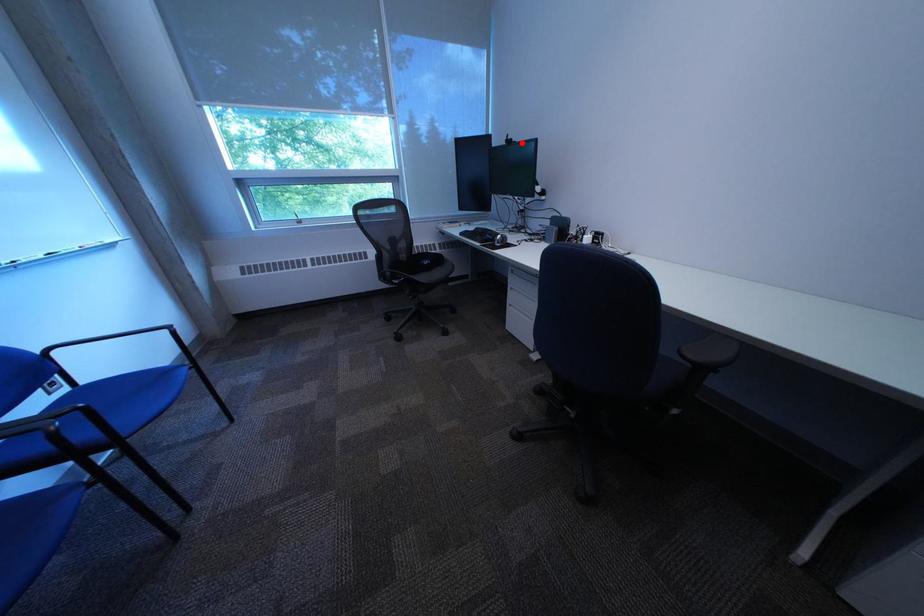
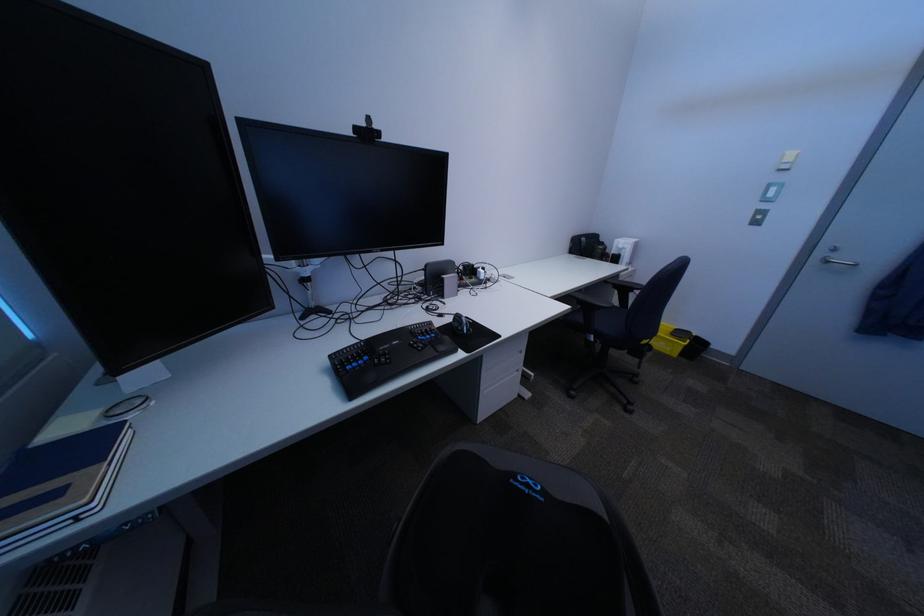
Question: I am providing you with two images of the same scene from different viewpoints. A red point is shown in image1. For the corresponding object point in image2, is it positioned nearer or farther from the camera?

Choices:
 (A) Nearer
 (B) Farther

Answer: (B)